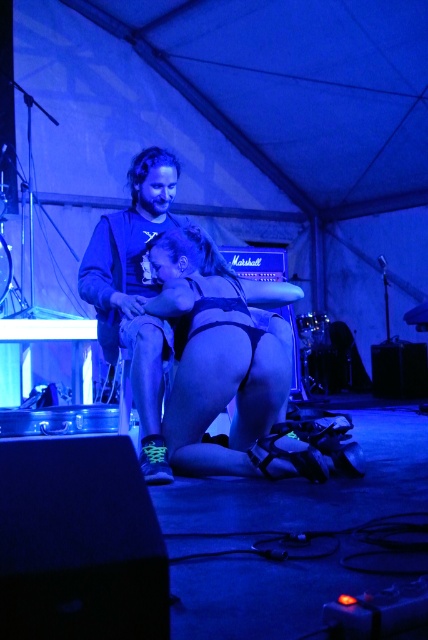
Between black matte bikini bottom at center and matte black shirt at center, which one has less height?

With less height is black matte bikini bottom at center.

Find the location of a particular element. The image size is (428, 640). black matte bikini bottom at center is located at coordinates (223, 364).